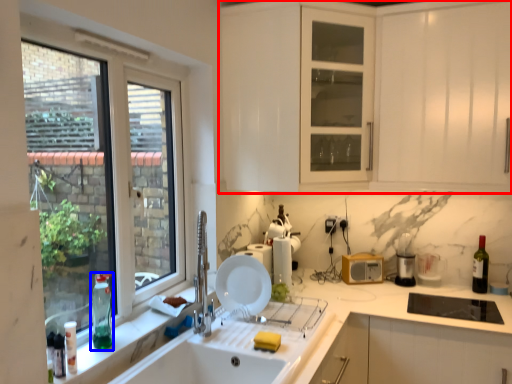
Question: Among these objects, which one is farthest to the camera, cabinetry (highlighted by a red box) or bottle (highlighted by a blue box)?

Choices:
 (A) cabinetry
 (B) bottle

Answer: (A)